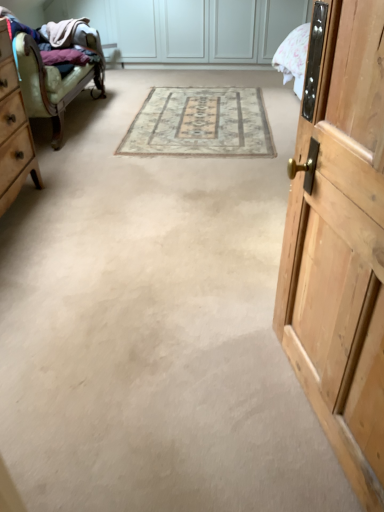
Question: Is point (38, 112) positioned closer to the camera than point (1, 199)?

Choices:
 (A) farther
 (B) closer

Answer: (A)

Question: In the image, is leather armchair at left on the left side or the right side of wooden dresser at left?

Choices:
 (A) right
 (B) left

Answer: (B)

Question: Which is nearer to the leather armchair at left?

Choices:
 (A) wooden door at right
 (B) beige carpet at center
 (C) wooden dresser at left

Answer: (C)

Question: Considering the real-world distances, which object is closest to the leather armchair at left?

Choices:
 (A) wooden door at right
 (B) wooden dresser at left
 (C) beige carpet at center

Answer: (B)